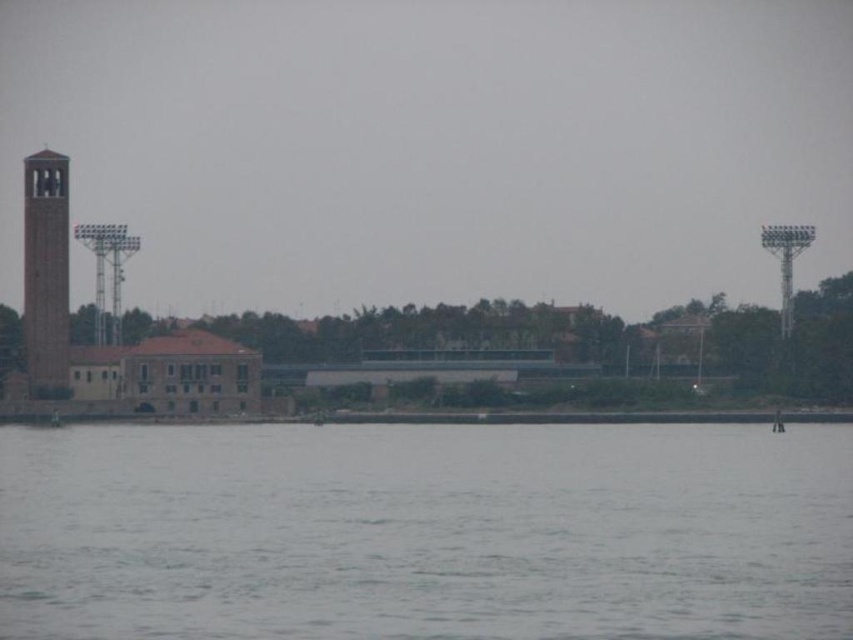
You are standing at the waterfront and see the gray water at lower center and the smooth stone bell tower at left. Which object is closer to your right side?

The gray water at lower center is closer to your right side because it is positioned to the right of the smooth stone bell tower at left.

You are standing at the waterfront looking at the scene. There are two points marked in the image, point A at coordinates point A is point (154, 497) and point B at point (62, 280). Which point is closer to you?

Point A at coordinates point A is point (154, 497) is closer to you because it is in front of point B at point (62, 280).

You are standing on the dock and see the point marked at coordinates point (425, 532). Is this point located on the gray water at lower center?

Yes, the point (425, 532) is on the gray water at lower center according to the description.